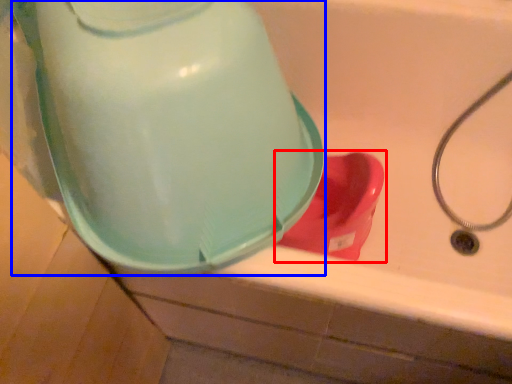
Question: Which object appears closest to the camera in this image, toilet (highlighted by a red box) or water cooler (highlighted by a blue box)?

Choices:
 (A) toilet
 (B) water cooler

Answer: (B)